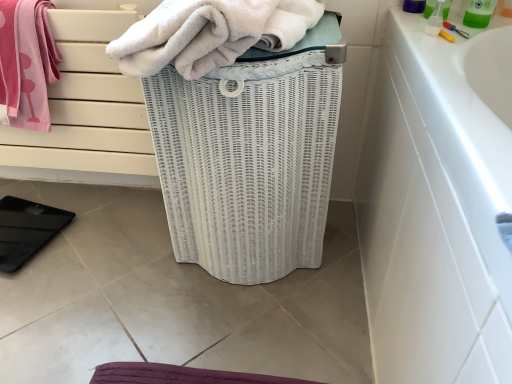
Find the location of `vacant space to the left of white wicker basket at center`. vacant space to the left of white wicker basket at center is located at coordinates (109, 259).